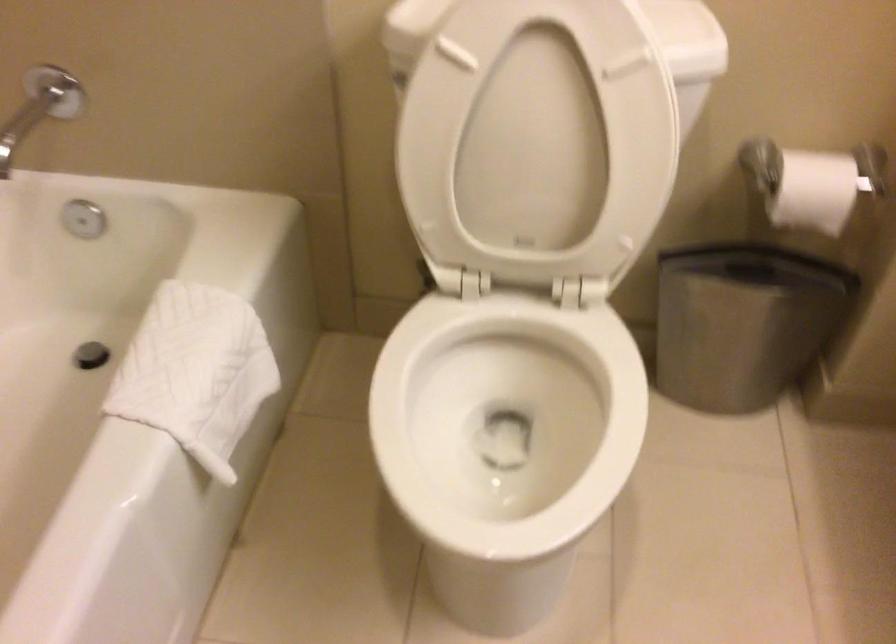
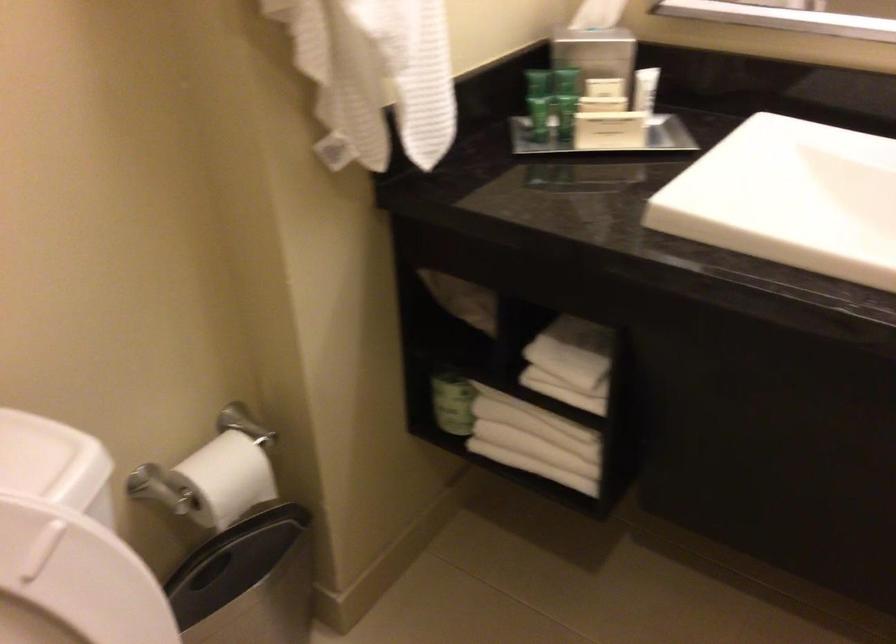
Question: Based on the continuous images, in which direction is the camera rotating? Reply with the corresponding letter.

Choices:
 (A) Left
 (B) Right
 (C) Up
 (D) Down

Answer: (B)